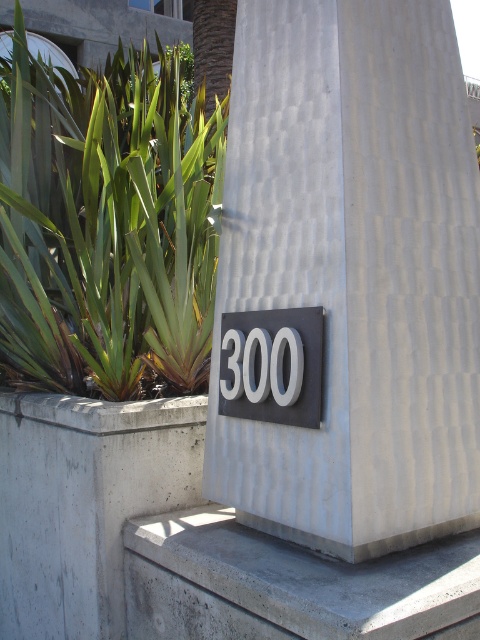
Does concrete at center come behind matte black sign at center?

No, concrete at center is closer to the viewer.

Is concrete at center wider than matte black sign at center?

Indeed, concrete at center has a greater width compared to matte black sign at center.

Which is in front, point (0, 556) or point (250, 340)?

Point (250, 340) is in front.

The height and width of the screenshot is (640, 480). I want to click on concrete at center, so tap(182, 541).

Which is below, concrete at center or green leafy plant at left?

concrete at center is below.

Is point (171, 435) farther from viewer compared to point (184, 371)?

No.

Where is `concrete at center`? The width and height of the screenshot is (480, 640). concrete at center is located at coordinates (182, 541).

Who is positioned more to the left, concrete at center or gray concrete ledge at lower center?

concrete at center

Does concrete at center appear under gray concrete ledge at lower center?

Actually, concrete at center is above gray concrete ledge at lower center.

Describe the element at coordinates (182, 541) in the screenshot. I see `concrete at center` at that location.

At what (x,y) coordinates should I click in order to perform the action: click on concrete at center. Please return your answer as a coordinate pair (x, y). Image resolution: width=480 pixels, height=640 pixels. Looking at the image, I should click on (182, 541).